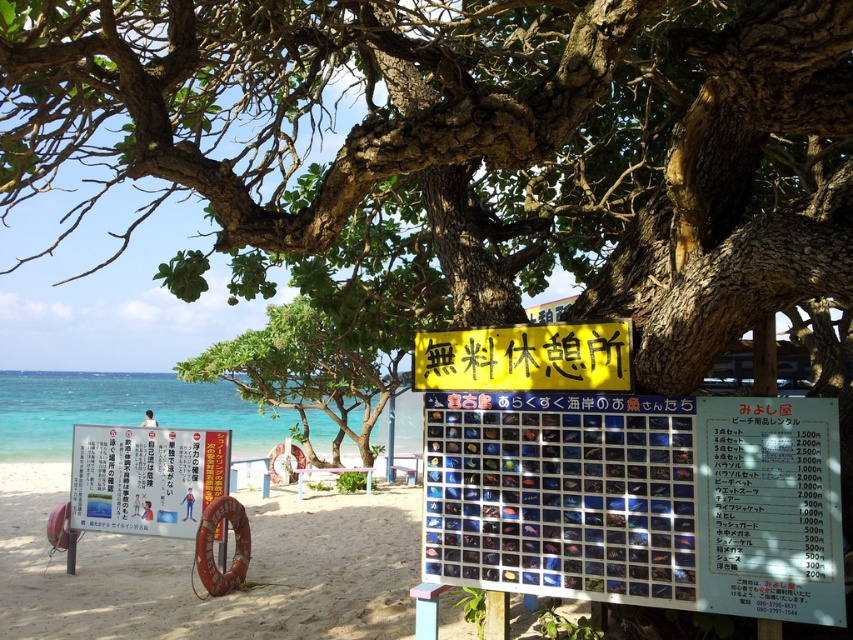
Question: Can you confirm if yellow paper at center is positioned to the left of white paper sign at lower left?

Choices:
 (A) yes
 (B) no

Answer: (B)

Question: Can you confirm if yellow paper at center is positioned above green leafy tree at center?

Choices:
 (A) no
 (B) yes

Answer: (A)

Question: Can you confirm if yellow paper at center is thinner than white paper sign at lower left?

Choices:
 (A) yes
 (B) no

Answer: (B)

Question: Among these points, which one is farthest from the camera?

Choices:
 (A) (209, 378)
 (B) (79, 435)

Answer: (A)

Question: Among these objects, which one is farthest from the camera?

Choices:
 (A) yellow paper at center
 (B) green leafy tree at center

Answer: (B)

Question: Which point is closer to the camera taking this photo?

Choices:
 (A) (117, 436)
 (B) (338, 420)
 (C) (471, 515)

Answer: (C)